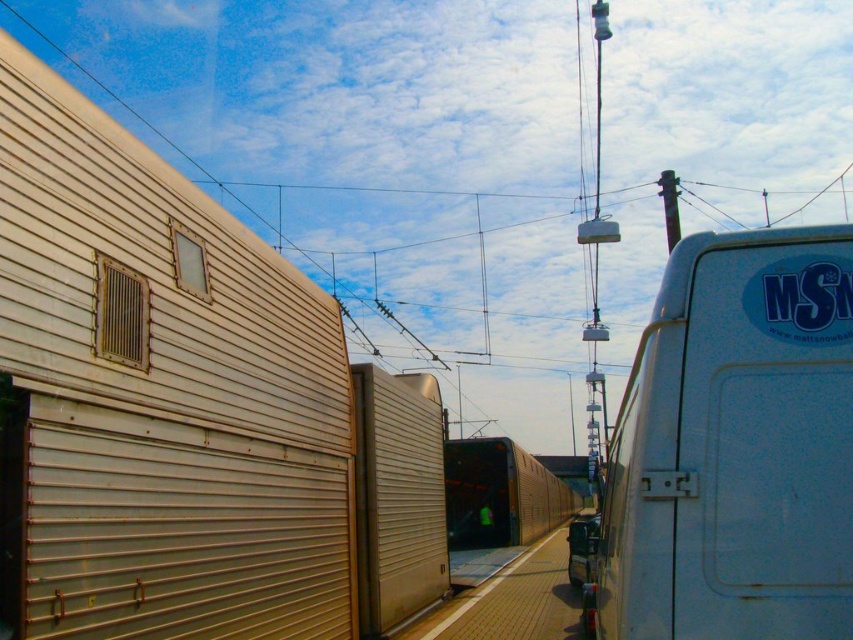
Does white speckled van at right have a lesser width compared to metallic silver train at center?

Yes.

Measure the distance between point (772,634) and camera.

A distance of 2.06 meters exists between point (772,634) and camera.

At what (x,y) coordinates should I click in order to perform the action: click on white speckled van at right. Please return your answer as a coordinate pair (x, y). Looking at the image, I should click on (735, 445).